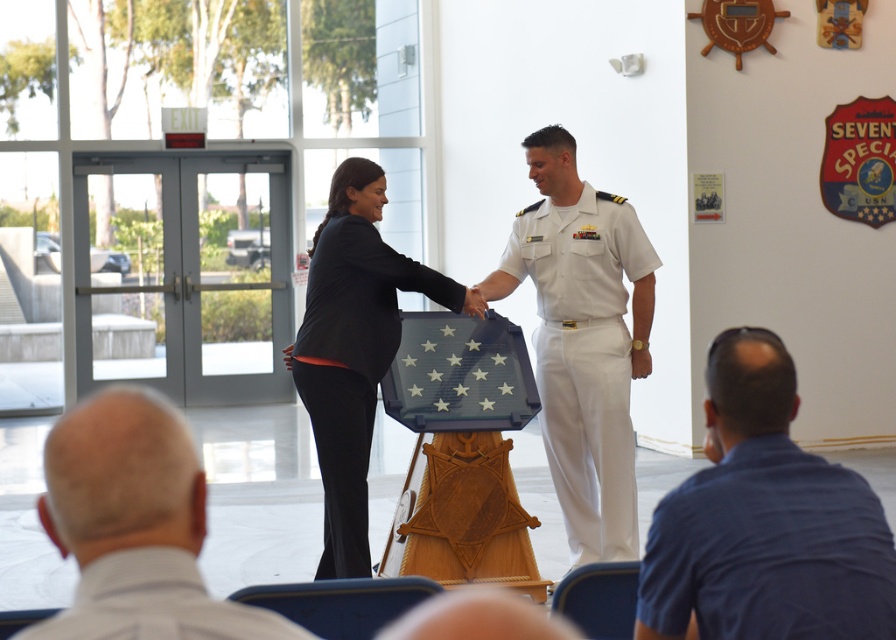
Question: Estimate the real-world distances between objects in this image. Which object is farther from the white cotton uniform at center?

Choices:
 (A) black fabric suit at center
 (B) white shirt at lower left
 (C) blue shirt at lower right
 (D) khaki fabric uniform at lower left

Answer: (D)

Question: Which object appears farthest from the camera in this image?

Choices:
 (A) white shirt at lower left
 (B) white cotton uniform at center

Answer: (B)

Question: Based on their relative distances, which object is nearer to the white shirt at lower left?

Choices:
 (A) khaki fabric uniform at lower left
 (B) black fabric suit at center

Answer: (A)

Question: Is white cotton uniform at center bigger than black fabric suit at center?

Choices:
 (A) no
 (B) yes

Answer: (A)

Question: Does blue shirt at lower right have a smaller size compared to white shirt at lower left?

Choices:
 (A) yes
 (B) no

Answer: (B)

Question: Is blue shirt at lower right thinner than khaki fabric uniform at lower left?

Choices:
 (A) yes
 (B) no

Answer: (B)